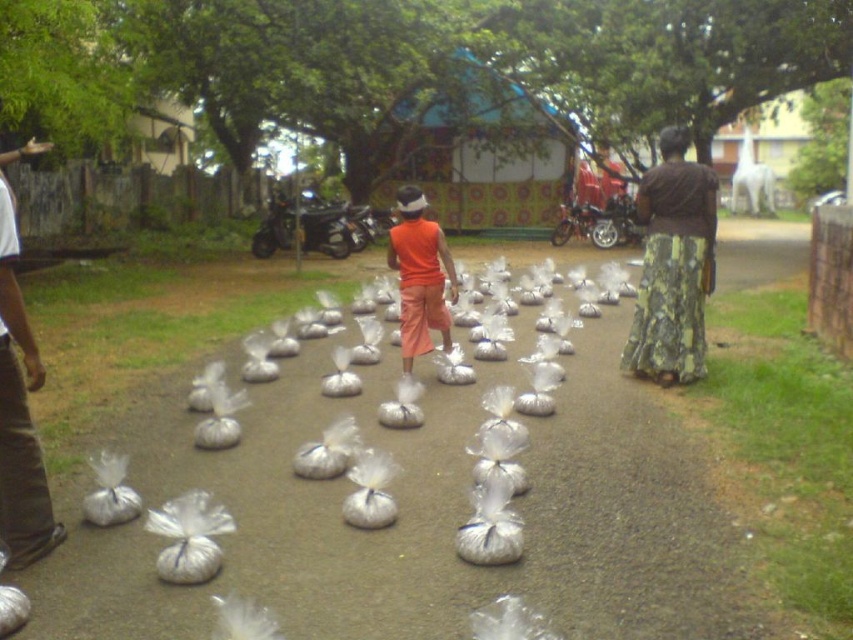
Question: Does green floral skirt at right lie in front of orange cotton shorts at center?

Choices:
 (A) yes
 (B) no

Answer: (A)

Question: Does brown corduroy pants at left appear over orange cotton shorts at center?

Choices:
 (A) yes
 (B) no

Answer: (B)

Question: Which object is farther from the camera taking this photo?

Choices:
 (A) transparent plastic bags at center
 (B) green floral skirt at right
 (C) orange cotton shorts at center
 (D) brown corduroy pants at left

Answer: (C)

Question: Which point is farther from the camera taking this photo?

Choices:
 (A) (641, 211)
 (B) (276, 397)

Answer: (A)

Question: Does brown corduroy pants at left lie in front of orange cotton shorts at center?

Choices:
 (A) no
 (B) yes

Answer: (B)

Question: Which object appears closest to the camera in this image?

Choices:
 (A) orange cotton shorts at center
 (B) brown corduroy pants at left

Answer: (B)